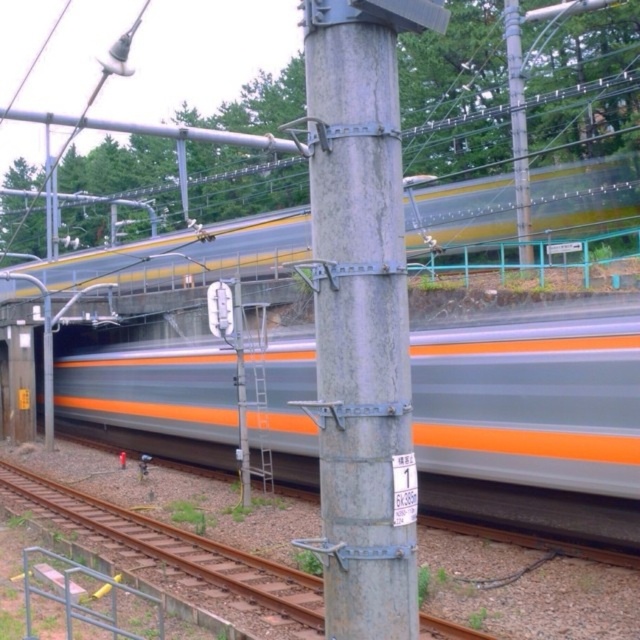
Is silver metallic train at center positioned in front of gray metallic pole at center?

No.

Who is more forward, (275, 420) or (365, 138)?

Point (365, 138) is more forward.

This screenshot has height=640, width=640. I want to click on silver metallic train at center, so click(532, 396).

Does silver metallic train at center appear on the left side of metallic gray telegraph pole at upper center?

Yes, silver metallic train at center is to the left of metallic gray telegraph pole at upper center.

At what (x,y) coordinates should I click in order to perform the action: click on silver metallic train at center. Please return your answer as a coordinate pair (x, y). Looking at the image, I should click on (532, 396).

This screenshot has width=640, height=640. Identify the location of silver metallic train at center. (532, 396).

Where is `gray metallic pole at center`? gray metallic pole at center is located at coordinates (360, 321).

Does gray metallic pole at center appear on the right side of metallic gray telegraph pole at upper center?

Incorrect, gray metallic pole at center is not on the right side of metallic gray telegraph pole at upper center.

This screenshot has width=640, height=640. I want to click on gray metallic pole at center, so [x=360, y=321].

The height and width of the screenshot is (640, 640). I want to click on gray metallic pole at center, so click(360, 321).